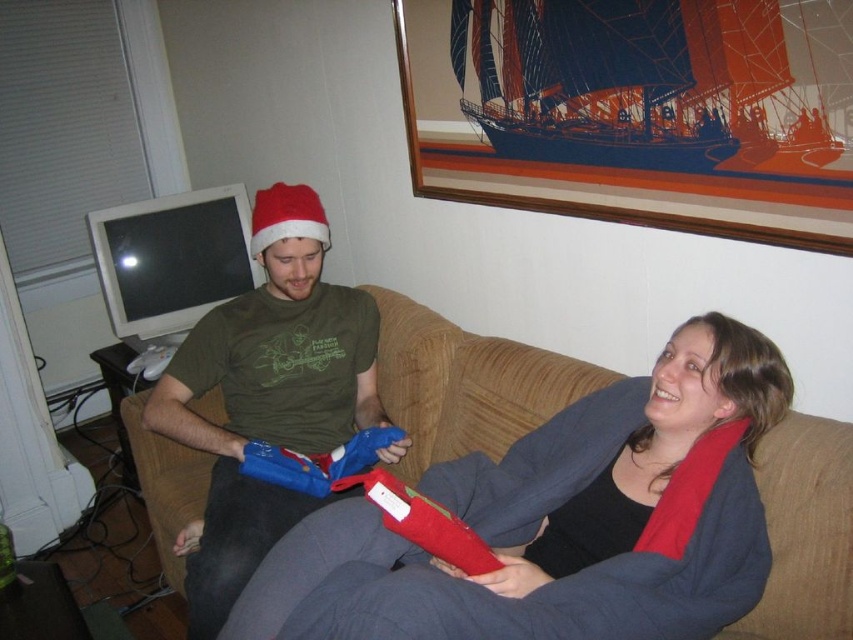
Question: Which of these objects is positioned closest to the wooden picture frame at upper right?

Choices:
 (A) matte green t-shirt at center
 (B) brown fabric couch at center

Answer: (B)

Question: Can you confirm if wooden picture frame at upper right is positioned to the left of matte green t-shirt at center?

Choices:
 (A) no
 (B) yes

Answer: (A)

Question: Which of the following is the closest to the observer?

Choices:
 (A) brown fabric couch at center
 (B) matte green t-shirt at center
 (C) wooden picture frame at upper right

Answer: (C)

Question: Can you confirm if wooden picture frame at upper right is positioned to the left of matte green t-shirt at center?

Choices:
 (A) no
 (B) yes

Answer: (A)

Question: Can you confirm if matte green t-shirt at center is bigger than brown fabric couch at center?

Choices:
 (A) no
 (B) yes

Answer: (B)

Question: Which of the following is the farthest from the observer?

Choices:
 (A) pos(219,605)
 (B) pos(846,499)

Answer: (A)